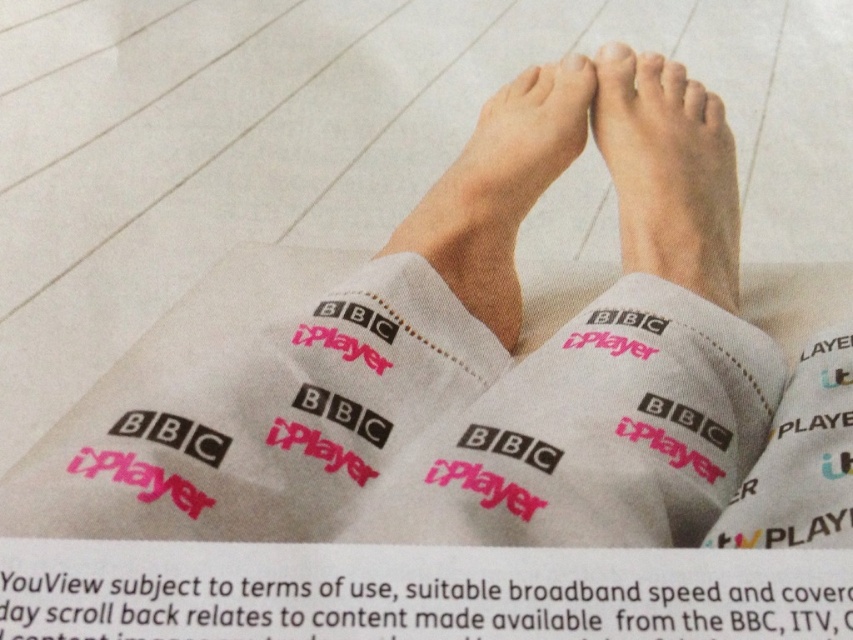
Is white cotton socks at center to the right of pink matte toe at upper center from the viewer's perspective?

In fact, white cotton socks at center is to the left of pink matte toe at upper center.

Does point (708, 474) lie in front of point (717, 113)?

Yes, it is.

The width and height of the screenshot is (853, 640). I want to click on white cotton socks at center, so click(578, 426).

Which of these two, smooth skin foot at center or skinny white leg at center, stands taller?

Standing taller between the two is skinny white leg at center.

The image size is (853, 640). What do you see at coordinates (666, 176) in the screenshot? I see `smooth skin foot at center` at bounding box center [666, 176].

The image size is (853, 640). What do you see at coordinates (666, 176) in the screenshot?
I see `smooth skin foot at center` at bounding box center [666, 176].

The height and width of the screenshot is (640, 853). What are the coordinates of `smooth skin foot at center` in the screenshot? It's located at (666, 176).

Who is more forward, (525, 76) or (706, 100)?

Point (706, 100)

Is pink matte toe at center below matte skin toe at upper center?

No.

Where is `pink matte toe at center`? The height and width of the screenshot is (640, 853). pink matte toe at center is located at coordinates (529, 83).